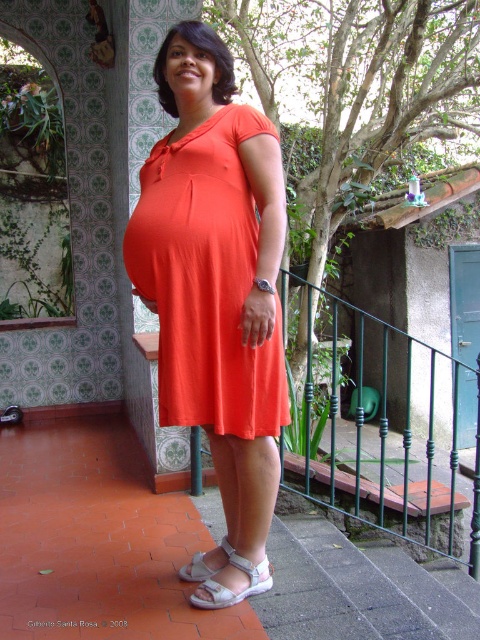
Question: Is orange matte dress at center positioned behind white leather sandal at lower center?

Choices:
 (A) yes
 (B) no

Answer: (B)

Question: Which is nearer to the white fabric sandal at lower center?

Choices:
 (A) orange matte dress at center
 (B) green metal balustrade at center

Answer: (A)

Question: Is green metal balustrade at center above white fabric sandal at lower center?

Choices:
 (A) yes
 (B) no

Answer: (A)

Question: Does green metal balustrade at center lie in front of white fabric sandal at lower center?

Choices:
 (A) no
 (B) yes

Answer: (A)

Question: Which object appears closest to the camera in this image?

Choices:
 (A) white leather sandal at lower center
 (B) orange matte dress at center

Answer: (B)

Question: Which of the following is the farthest from the observer?

Choices:
 (A) white fabric sandal at lower center
 (B) green metal balustrade at center

Answer: (B)